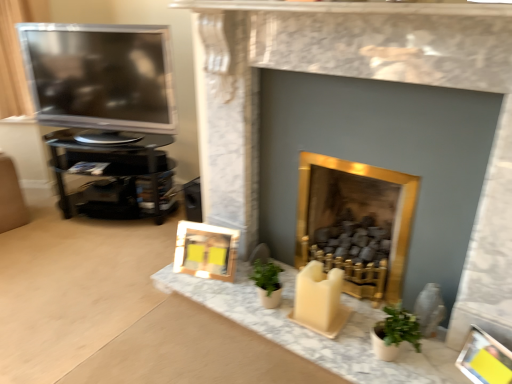
Measure the distance between point (79, 172) and camera.

Point (79, 172) is 8.06 feet from camera.

What do you see at coordinates (115, 176) in the screenshot?
I see `black glossy tv stand at left` at bounding box center [115, 176].

What do you see at coordinates (356, 223) in the screenshot? The width and height of the screenshot is (512, 384). I see `gold metallic fireplace at center, marked as the 1th fireplace in a right-to-left arrangement` at bounding box center [356, 223].

Find the location of a particular element. The height and width of the screenshot is (384, 512). satin black television at left is located at coordinates (100, 76).

This screenshot has width=512, height=384. Describe the element at coordinates (485, 359) in the screenshot. I see `yellow paper picture frame at lower right, which is counted as the 2th picture frame, starting from the top` at that location.

What is the approximate width of wooden frame at lower center, which appears as the 1th picture frame when viewed from the left?

wooden frame at lower center, which appears as the 1th picture frame when viewed from the left, is 7.40 inches in width.

Locate an element on the screen. black glossy tv stand at left is located at coordinates (115, 176).

Is wooden frame at lower center, the second picture frame when ordered from right to left, located outside gold metallic fireplace at center, marked as the 1th fireplace in a right-to-left arrangement?

Yes.

How many degrees apart are the facing directions of wooden frame at lower center, which ranks as the first picture frame in back-to-front order, and gold metallic fireplace at center, marked as the 1th fireplace in a right-to-left arrangement?

16 degrees.

Is wooden frame at lower center, which is the 2th picture frame in bottom-to-top order, wider or thinner than gold metallic fireplace at center, marked as the 1th fireplace in a right-to-left arrangement?

Clearly, wooden frame at lower center, which is the 2th picture frame in bottom-to-top order, has less width compared to gold metallic fireplace at center, marked as the 1th fireplace in a right-to-left arrangement.

Does wooden frame at lower center, placed as the second picture frame when sorted from front to back, appear on the right side of gold metallic fireplace at center, marked as the 1th fireplace in a right-to-left arrangement?

Incorrect, wooden frame at lower center, placed as the second picture frame when sorted from front to back, is not on the right side of gold metallic fireplace at center, marked as the 1th fireplace in a right-to-left arrangement.

From a real-world perspective, between gold metallic fireplace at center, marked as the 1th fireplace in a right-to-left arrangement, and yellow paper picture frame at lower right, which is counted as the 2th picture frame, starting from the top, who is vertically lower?

From a 3D spatial view, yellow paper picture frame at lower right, which is counted as the 2th picture frame, starting from the top, is below.

Is gold metallic fireplace at center, which is the 2th fireplace from left to right, looking in the opposite direction of yellow paper picture frame at lower right, which is counted as the 2th picture frame, starting from the top?

gold metallic fireplace at center, which is the 2th fireplace from left to right, is not turned away from yellow paper picture frame at lower right, which is counted as the 2th picture frame, starting from the top.

In terms of width, does gold metallic fireplace at center, which is the 2th fireplace from left to right, look wider or thinner when compared to yellow paper picture frame at lower right, acting as the 1th picture frame starting from the bottom?

In the image, gold metallic fireplace at center, which is the 2th fireplace from left to right, appears to be wider than yellow paper picture frame at lower right, acting as the 1th picture frame starting from the bottom.

Measure the distance from gold metallic fireplace at center, which is the 2th fireplace from left to right, to yellow paper picture frame at lower right, acting as the 1th picture frame starting from the bottom.

The distance of gold metallic fireplace at center, which is the 2th fireplace from left to right, from yellow paper picture frame at lower right, acting as the 1th picture frame starting from the bottom, is 23.15 inches.

Which is more to the left, matte gray vase at lower right or black glossy tv stand at left?

From the viewer's perspective, black glossy tv stand at left appears more on the left side.

Can black glossy tv stand at left be found inside matte gray vase at lower right?

No, black glossy tv stand at left is located outside of matte gray vase at lower right.

From a real-world perspective, which is physically below, matte gray vase at lower right or black glossy tv stand at left?

matte gray vase at lower right.

Is point (426, 294) closer or farther from the camera than point (66, 214)?

Point (426, 294) is closer to the camera than point (66, 214).

Can you confirm if gold marble fireplace at center, acting as the first fireplace starting from the left, is bigger than gold metallic fireplace at center, marked as the 1th fireplace in a right-to-left arrangement?

Correct, gold marble fireplace at center, acting as the first fireplace starting from the left, is larger in size than gold metallic fireplace at center, marked as the 1th fireplace in a right-to-left arrangement.

Which is closer, [437,32] or [370,192]?

The point [437,32] is more forward.

Is gold marble fireplace at center, which is the second fireplace from right to left, inside the boundaries of gold metallic fireplace at center, marked as the 1th fireplace in a right-to-left arrangement, or outside?

gold marble fireplace at center, which is the second fireplace from right to left, lies outside gold metallic fireplace at center, marked as the 1th fireplace in a right-to-left arrangement.

Based on the photo, from the image's perspective, is gold marble fireplace at center, which is the second fireplace from right to left, on gold metallic fireplace at center, marked as the 1th fireplace in a right-to-left arrangement?

Yes, from the image's perspective, gold marble fireplace at center, which is the second fireplace from right to left, is over gold metallic fireplace at center, marked as the 1th fireplace in a right-to-left arrangement.

Between point (57, 35) and point (490, 367), which one is positioned in front?

Point (490, 367)

Looking at their sizes, would you say satin black television at left is wider or thinner than yellow paper picture frame at lower right, which is counted as the 2th picture frame, starting from the top?

Considering their sizes, satin black television at left looks broader than yellow paper picture frame at lower right, which is counted as the 2th picture frame, starting from the top.

From a real-world perspective, is satin black television at left below yellow paper picture frame at lower right, which is counted as the 1th picture frame, starting from the right?

Actually, satin black television at left is physically above yellow paper picture frame at lower right, which is counted as the 1th picture frame, starting from the right, in the real world.

Is satin black television at left smaller than yellow paper picture frame at lower right, which is counted as the 1th picture frame, starting from the right?

No, satin black television at left is not smaller than yellow paper picture frame at lower right, which is counted as the 1th picture frame, starting from the right.

Visually, is black glossy tv stand at left positioned to the left or to the right of satin black television at left?

Based on their positions, black glossy tv stand at left is located to the left of satin black television at left.

In terms of size, does black glossy tv stand at left appear bigger or smaller than satin black television at left?

In the image, black glossy tv stand at left appears to be larger than satin black television at left.

Is black glossy tv stand at left far from satin black television at left?

No.

Does gold metallic fireplace at center, marked as the 1th fireplace in a right-to-left arrangement, come in front of black glossy tv stand at left?

Yes, gold metallic fireplace at center, marked as the 1th fireplace in a right-to-left arrangement, is closer to the camera.

Can you see gold metallic fireplace at center, which is the 2th fireplace from left to right, touching black glossy tv stand at left?

There is a gap between gold metallic fireplace at center, which is the 2th fireplace from left to right, and black glossy tv stand at left.

Starting from the black glossy tv stand at left, which fireplace is the 1st one in front? Please provide its 2D coordinates.

[(356, 223)]

What's the angular difference between gold metallic fireplace at center, which is the 2th fireplace from left to right, and black glossy tv stand at left's facing directions?

The facing directions of gold metallic fireplace at center, which is the 2th fireplace from left to right, and black glossy tv stand at left are 23.9 degrees apart.

From the image's perspective, which fireplace is the 1st one above the wooden frame at lower center, which appears as the 1th picture frame when viewed from the left? Please provide its 2D coordinates.

[(356, 223)]

This screenshot has height=384, width=512. Identify the location of picture frame that is the 2nd object directly below the gold metallic fireplace at center, marked as the 1th fireplace in a right-to-left arrangement (from a real-world perspective). (485, 359).

From the image, which object appears to be farther from yellow paper picture frame at lower right, acting as the 1th picture frame starting from the bottom, satin black television at left or gold marble fireplace at center, which is the second fireplace from right to left?

satin black television at left is positioned further to the anchor yellow paper picture frame at lower right, acting as the 1th picture frame starting from the bottom.

Looking at the image, which one is located further to gold marble fireplace at center, which is the second fireplace from right to left, satin black television at left or matte gray vase at lower right?

satin black television at left.

Based on their spatial positions, is yellow paper picture frame at lower right, placed as the 2th picture frame when sorted from left to right, or gold metallic fireplace at center, which is the 2th fireplace from left to right, closer to black glossy tv stand at left?

The object closer to black glossy tv stand at left is gold metallic fireplace at center, which is the 2th fireplace from left to right.

From the image, which object appears to be nearer to wooden frame at lower center, which is the 2th picture frame in bottom-to-top order, matte gray vase at lower right or gold marble fireplace at center, which is the second fireplace from right to left?

The object closer to wooden frame at lower center, which is the 2th picture frame in bottom-to-top order, is gold marble fireplace at center, which is the second fireplace from right to left.

Considering their positions, is satin black television at left positioned closer to black glossy tv stand at left than wooden frame at lower center, which is the 2th picture frame in bottom-to-top order?

satin black television at left lies closer to black glossy tv stand at left than the other object.

Based on their spatial positions, is gold metallic fireplace at center, marked as the 1th fireplace in a right-to-left arrangement, or gold marble fireplace at center, acting as the first fireplace starting from the left, further from yellow paper picture frame at lower right, which is counted as the 2th picture frame, starting from the top?

Among the two, gold marble fireplace at center, acting as the first fireplace starting from the left, is located further to yellow paper picture frame at lower right, which is counted as the 2th picture frame, starting from the top.

Considering their positions, is yellow paper picture frame at lower right, which is counted as the 1th picture frame, starting from the right, positioned closer to black glossy tv stand at left than wooden frame at lower center, the second picture frame when ordered from right to left?

wooden frame at lower center, the second picture frame when ordered from right to left.

Which object lies nearer to the anchor point gold metallic fireplace at center, which is the 2th fireplace from left to right, matte gray vase at lower right or satin black television at left?

matte gray vase at lower right lies closer to gold metallic fireplace at center, which is the 2th fireplace from left to right, than the other object.

This screenshot has width=512, height=384. Identify the location of picture frame between black glossy tv stand at left and matte gray vase at lower right. (206, 251).

The image size is (512, 384). I want to click on gray between gold marble fireplace at center, which is the second fireplace from right to left, and wooden frame at lower center, which is counted as the 1th picture frame, starting from the top, along the z-axis, so click(x=429, y=309).

Find the location of `fireplace that lies between gold marble fireplace at center, acting as the first fireplace starting from the left, and yellow paper picture frame at lower right, which is counted as the 1th picture frame, starting from the right, from top to bottom`. fireplace that lies between gold marble fireplace at center, acting as the first fireplace starting from the left, and yellow paper picture frame at lower right, which is counted as the 1th picture frame, starting from the right, from top to bottom is located at coordinates (356, 223).

Find the location of a particular element. The height and width of the screenshot is (384, 512). picture frame situated between satin black television at left and gold marble fireplace at center, acting as the first fireplace starting from the left, from left to right is located at coordinates (206, 251).